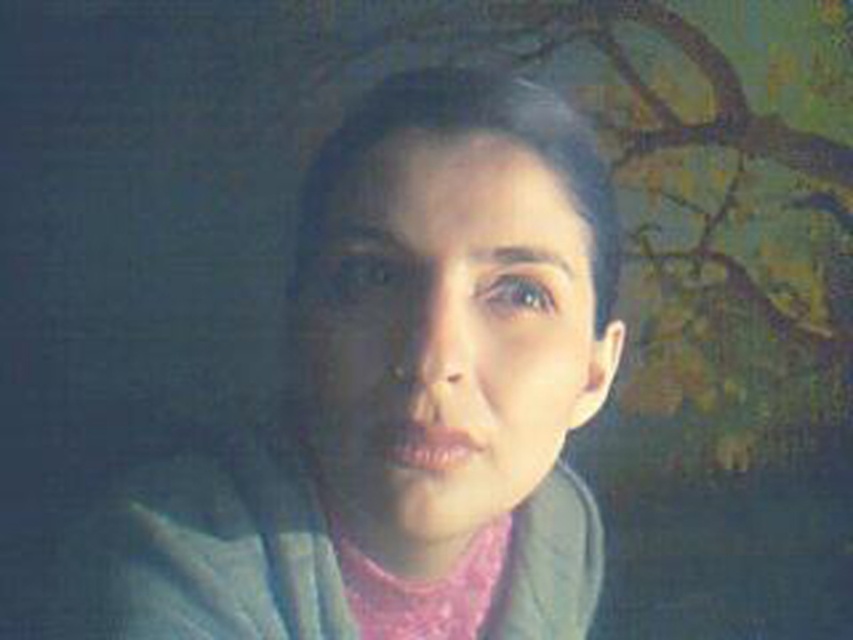
Can you confirm if matte blue jacket at center is thinner than pink satin scarf at center?

No, matte blue jacket at center is not thinner than pink satin scarf at center.

Does matte blue jacket at center appear on the left side of pink satin scarf at center?

Yes, matte blue jacket at center is to the left of pink satin scarf at center.

Is point (86, 561) positioned behind point (344, 588)?

No, (86, 561) is closer to viewer.

Where is `matte blue jacket at center`? matte blue jacket at center is located at coordinates (402, 397).